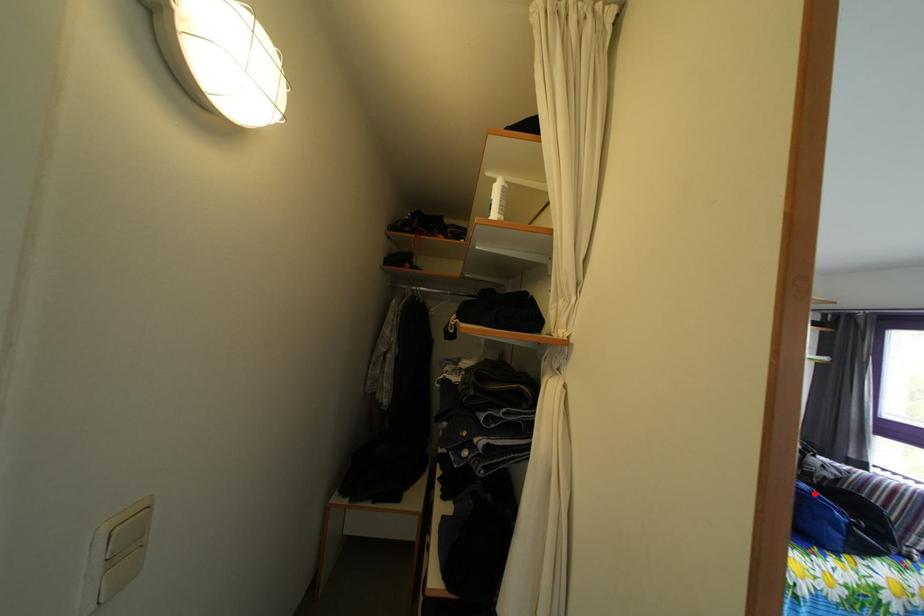
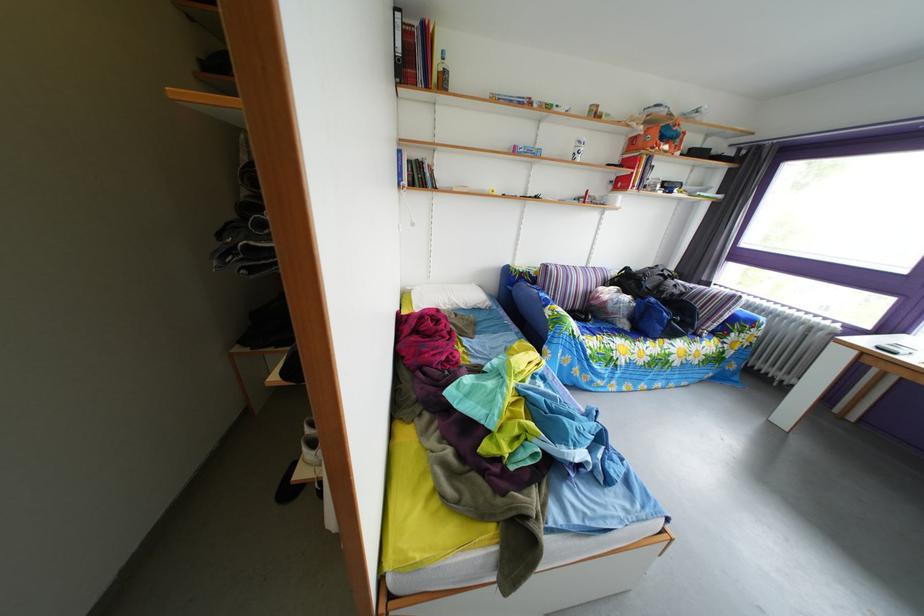
Question: I am providing you with two images of the same scene from different viewpoints. In image1, a red point is highlighted. Considering the same 3D point in image2, which of the following is correct?

Choices:
 (A) It is closer
 (B) It is farther

Answer: (B)